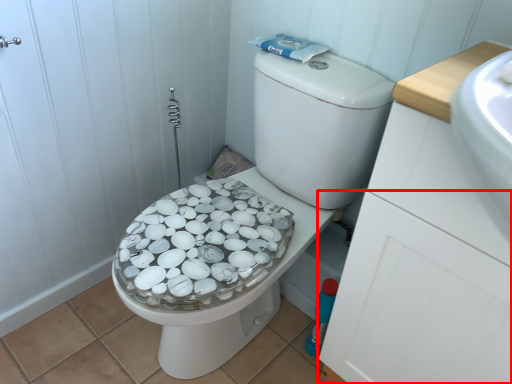
Question: Considering the relative positions of drawer (annotated by the red box) and bidet in the image provided, where is drawer (annotated by the red box) located with respect to the staircase?

Choices:
 (A) left
 (B) right

Answer: (B)